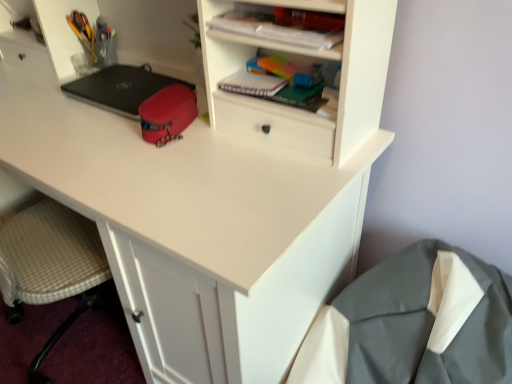
Locate an element on the screen. The width and height of the screenshot is (512, 384). vacant area on top of matte plastic notebook at upper center (from a real-world perspective) is located at coordinates (286, 17).